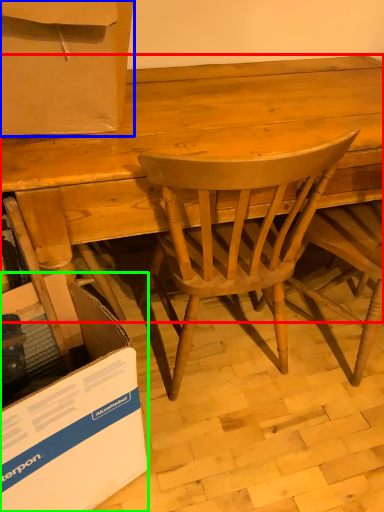
Question: Considering the real-world distances, which object is farthest from desk (highlighted by a red box)? box (highlighted by a blue box) or cardboard box (highlighted by a green box)?

Choices:
 (A) box
 (B) cardboard box

Answer: (B)